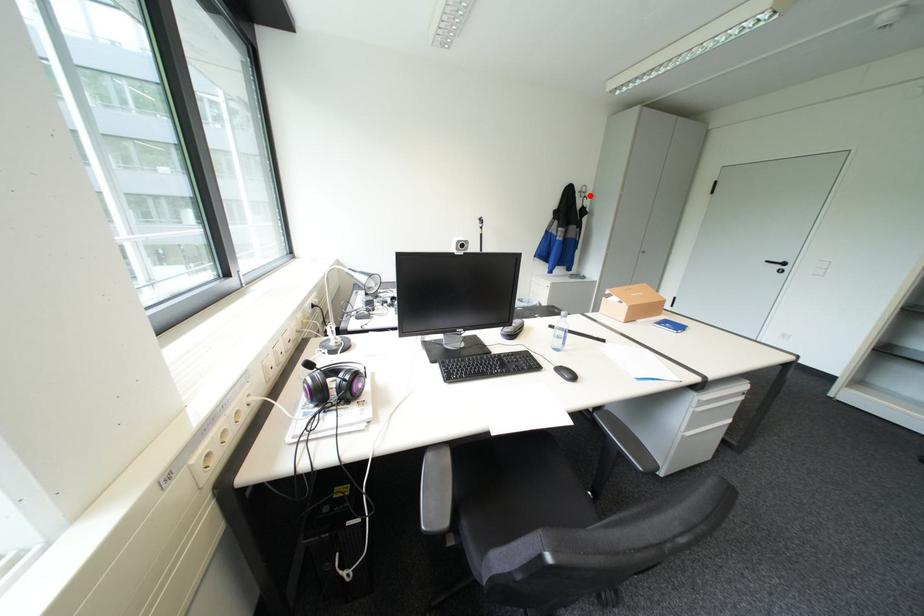
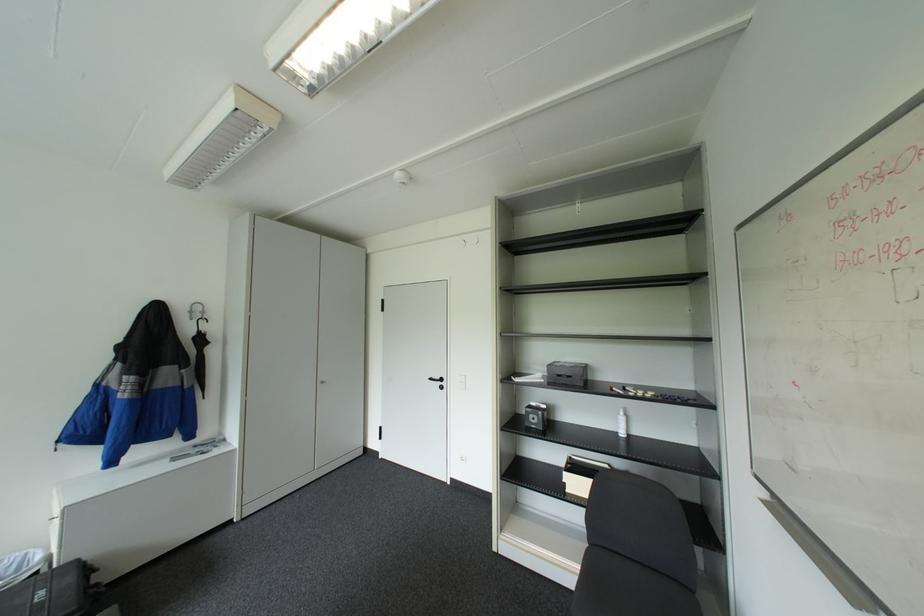
The point at the highlighted location is marked in the first image. Where is the corresponding point in the second image?

(200, 318)